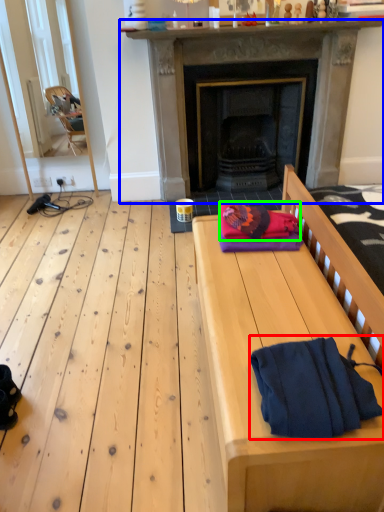
Question: Which is nearer to the bath towel (highlighted by a red box)? fireplace (highlighted by a blue box) or blanket (highlighted by a green box).

Choices:
 (A) fireplace
 (B) blanket

Answer: (B)